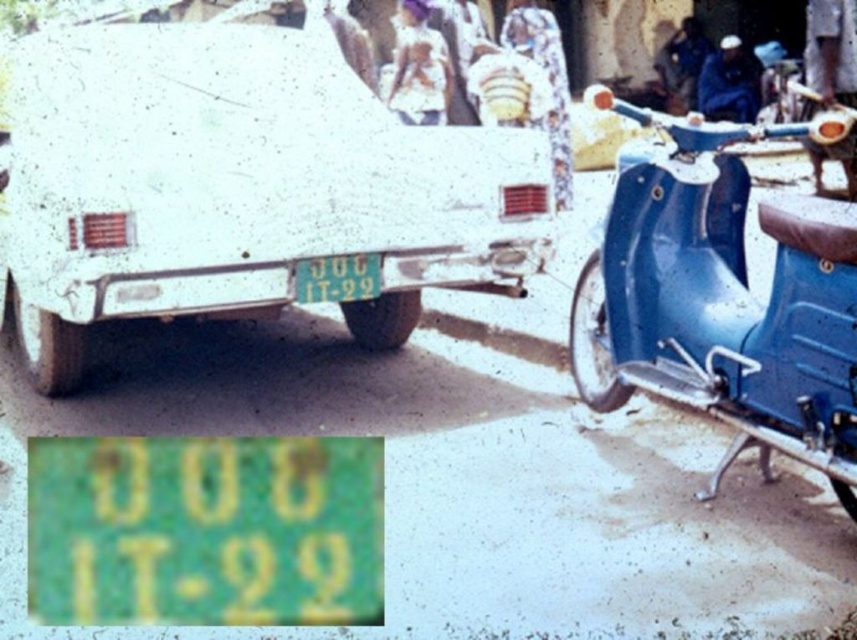
Question: Can you confirm if white matte car at center is wider than green matte license plate at center?

Choices:
 (A) yes
 (B) no

Answer: (A)

Question: Which object appears farthest from the camera in this image?

Choices:
 (A) green matte license plate at center
 (B) white matte car at center

Answer: (A)

Question: Is white matte car at center wider than green matte license plate at center?

Choices:
 (A) yes
 (B) no

Answer: (A)

Question: Is white matte car at center above green matte license plate at center?

Choices:
 (A) no
 (B) yes

Answer: (B)